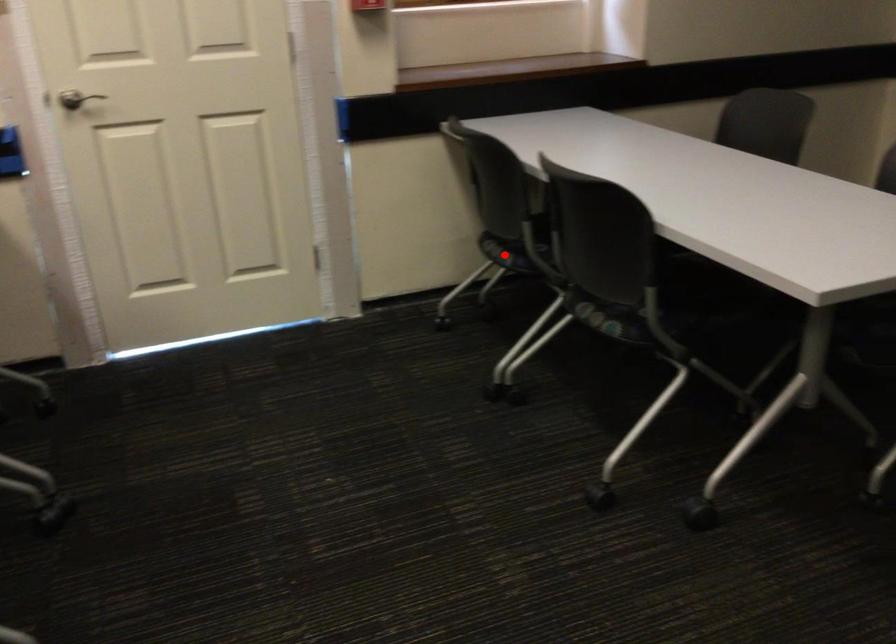
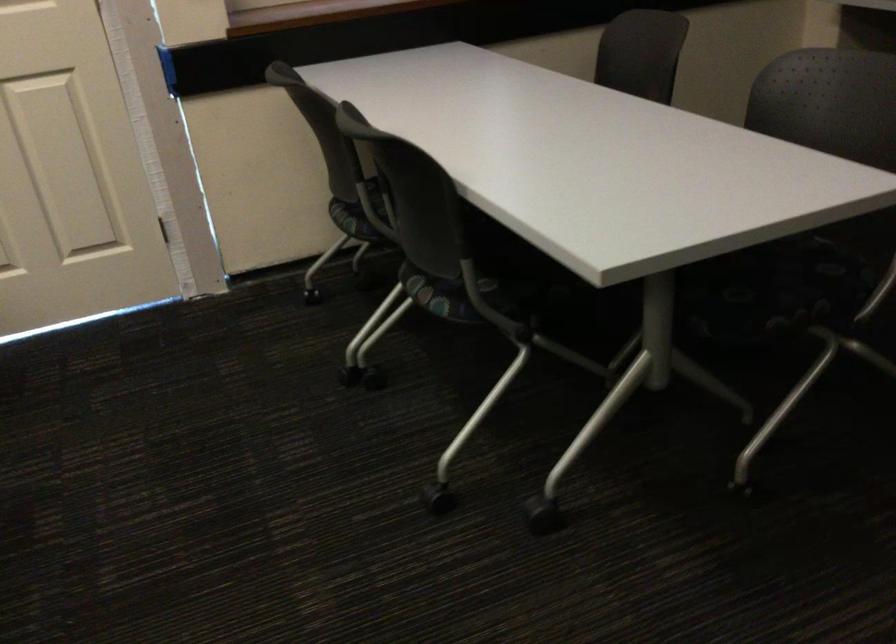
Find the pixel in the second image that matches the highlighted location in the first image.

(350, 220)